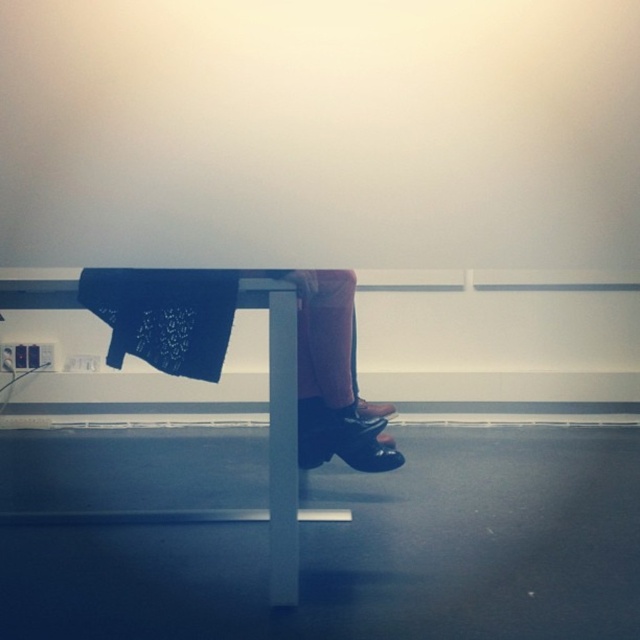
In the scene shown: Does white glossy table at center have a larger size compared to blue textured fabric at center?

Yes.

Who is positioned more to the left, white glossy table at center or blue textured fabric at center?

white glossy table at center

This screenshot has height=640, width=640. I want to click on white glossy table at center, so click(x=268, y=449).